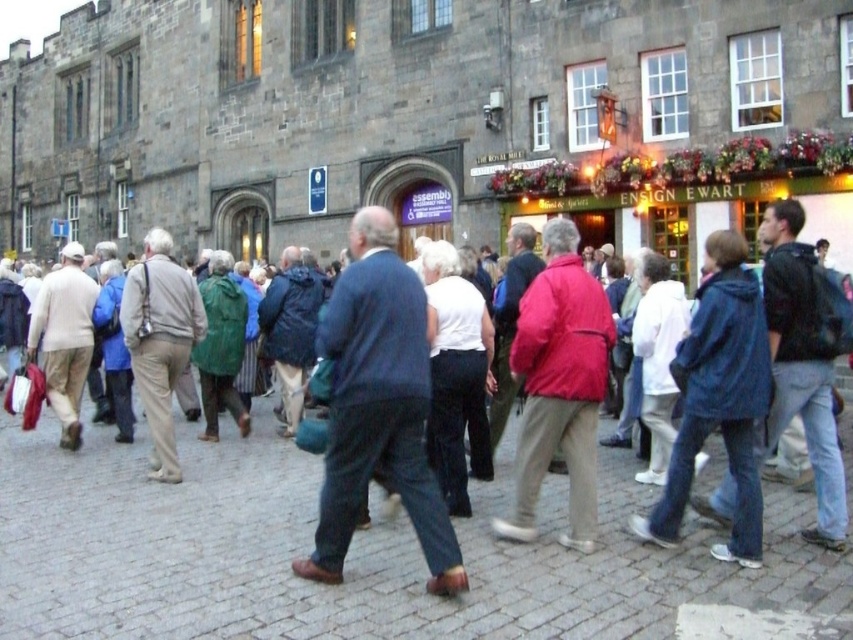
Question: Is blue fabric jacket at center bigger than blue denim jacket at center?

Choices:
 (A) yes
 (B) no

Answer: (A)

Question: Can you confirm if blue fabric jacket at center is wider than red matte jacket at center?

Choices:
 (A) no
 (B) yes

Answer: (B)

Question: Considering the real-world distances, which object is farthest from the blue fabric jacket at center?

Choices:
 (A) blue denim jacket at lower right
 (B) red matte jacket at center
 (C) blue denim jacket at center

Answer: (A)

Question: Which point appears farthest from the camera in this image?

Choices:
 (A) (599, 305)
 (B) (128, 458)
 (C) (738, 337)
 (D) (422, 323)

Answer: (B)

Question: Which is nearer to the blue denim jacket at center?

Choices:
 (A) blue fabric jacket at center
 (B) blue denim jacket at lower right
 (C) red matte jacket at center
 (D) brick pavement at center

Answer: (D)

Question: Does brick pavement at center appear on the left side of blue fabric jacket at center?

Choices:
 (A) no
 (B) yes

Answer: (A)